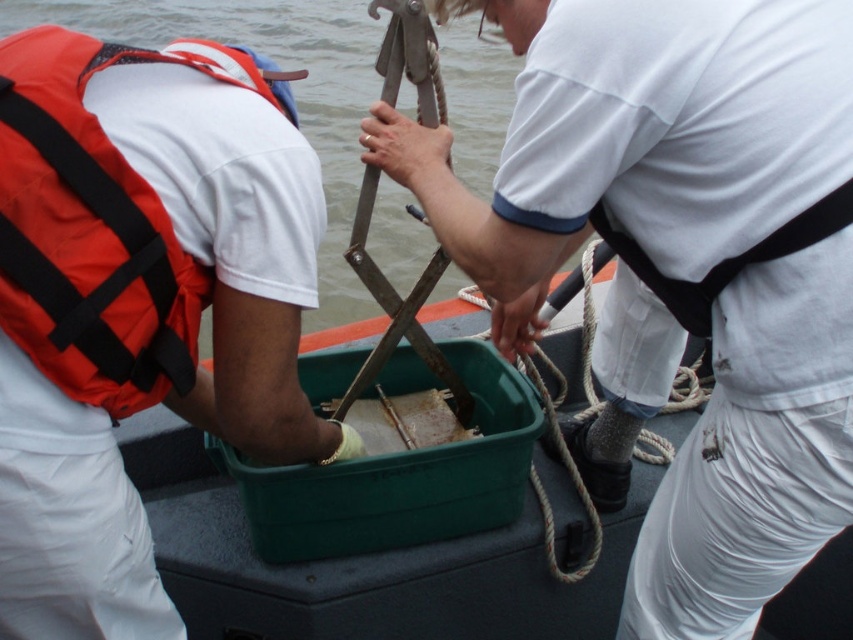
Looking at this image, does white matte shirt at center come behind clear water at upper center?

No, white matte shirt at center is in front of clear water at upper center.

Which of these two, white matte shirt at center or clear water at upper center, stands shorter?

With less height is white matte shirt at center.

Describe the element at coordinates (637, 138) in the screenshot. This screenshot has width=853, height=640. I see `white matte shirt at center` at that location.

Image resolution: width=853 pixels, height=640 pixels. What are the coordinates of `white matte shirt at center` in the screenshot? It's located at (637, 138).

Can you confirm if white matte shirt at center is wider than orange fabric life jacket at left?

Indeed, white matte shirt at center has a greater width compared to orange fabric life jacket at left.

Does white matte shirt at center appear over orange fabric life jacket at left?

No, white matte shirt at center is not above orange fabric life jacket at left.

Which is behind, point (734, 305) or point (114, 310)?

Point (734, 305)

Identify the location of white matte shirt at center. (637, 138).

Is orange fabric life jacket at left shorter than clear water at upper center?

Yes, orange fabric life jacket at left is shorter than clear water at upper center.

Does orange fabric life jacket at left have a greater height compared to clear water at upper center?

No.

Where is `orange fabric life jacket at left`? orange fabric life jacket at left is located at coordinates (94, 227).

Find the location of a particular element. This screenshot has width=853, height=640. orange fabric life jacket at left is located at coordinates (94, 227).